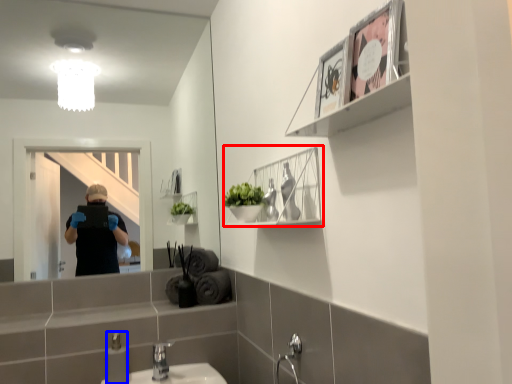
Question: Which of the following is the closest to the observer, cabinet (highlighted by a red box) or toiletry (highlighted by a blue box)?

Choices:
 (A) cabinet
 (B) toiletry

Answer: (A)